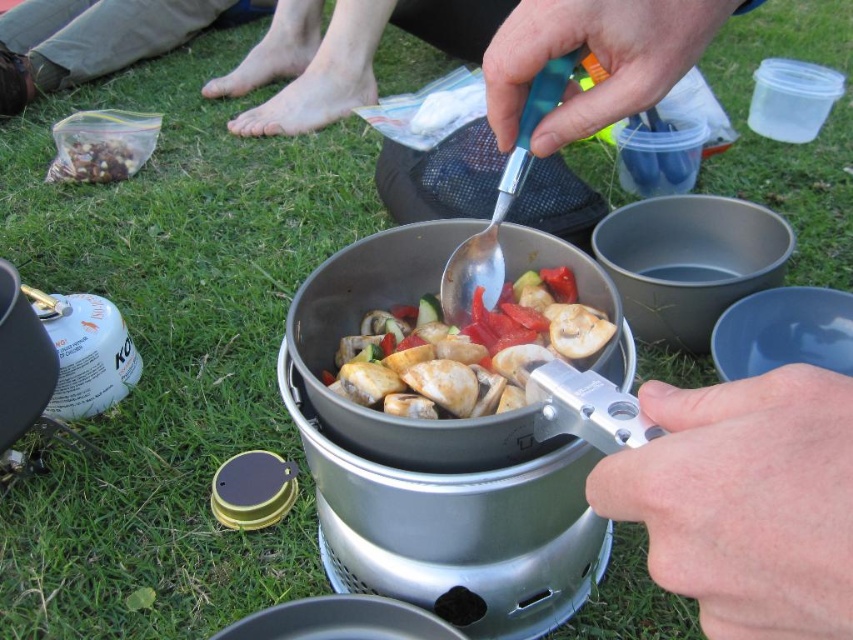
Based on the photo, you are a hiker who just arrived at the campsite. You see the barefoot skin at upper center and the brown crumbly mix at upper left. Which object is closer to the top of the image?

A: The barefoot skin at upper center is much taller as brown crumbly mix at upper left, so the barefoot skin at upper center is closer to the top of the image.

You are a hiker who just arrived at the campsite and see the barefoot skin at upper center and the brown crumbly mix at upper left. You want to pick up the mix but need to avoid stepping on the barefoot skin. Which object is farther away from you?

The brown crumbly mix at upper left is behind the barefoot skin at upper center, so it is farther away from you.

You are standing in the outdoor cooking area and want to place a small spice jar between the two points labeled point (9, 10) and point (70, 156). Which point should you place it closer to if you want the spice jar to be closer to you?

You should place the spice jar closer to point (9, 10) because it is closer to you than point (70, 156).